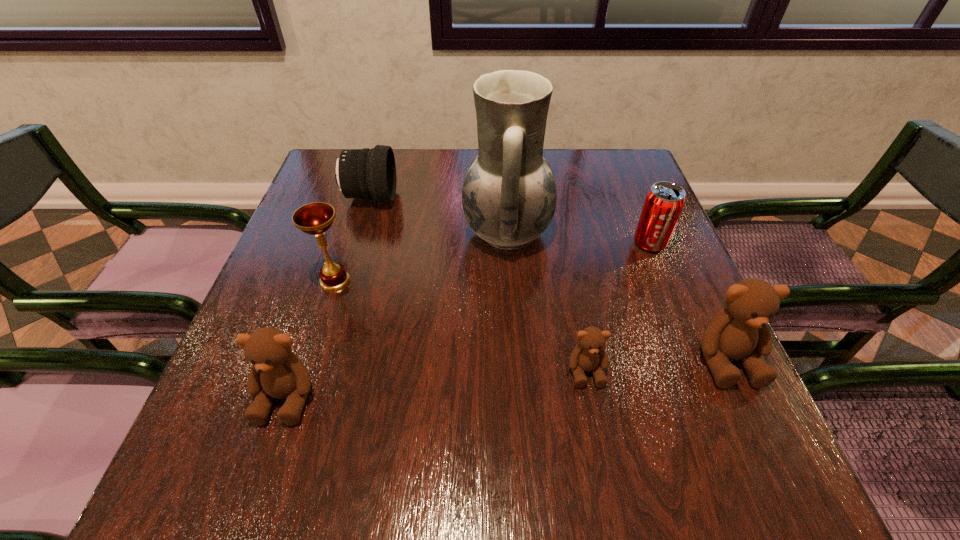
This screenshot has height=540, width=960. Find the location of `soda can located in the right edge section of the desktop`. soda can located in the right edge section of the desktop is located at coordinates (664, 202).

Where is `object that is at the far left corner`? object that is at the far left corner is located at coordinates [366, 173].

Where is `object that is at the near left corner`? object that is at the near left corner is located at coordinates (277, 372).

The image size is (960, 540). What are the coordinates of `object at the near right corner` in the screenshot? It's located at (740, 332).

In the image, there is a desktop. Find the location of `vacant space at the far edge`. vacant space at the far edge is located at coordinates (457, 173).

Where is `vacant space at the near edge of the desktop`? This screenshot has width=960, height=540. vacant space at the near edge of the desktop is located at coordinates (552, 408).

This screenshot has height=540, width=960. What are the coordinates of `free spot at the left edge of the desktop` in the screenshot? It's located at (286, 292).

This screenshot has width=960, height=540. In the image, there is a desktop. What are the coordinates of `free space at the right edge` in the screenshot? It's located at (654, 377).

In order to click on vacant region at the far left corner of the desktop in this screenshot , I will do `click(314, 183)`.

This screenshot has height=540, width=960. I want to click on free space at the far right corner, so click(603, 158).